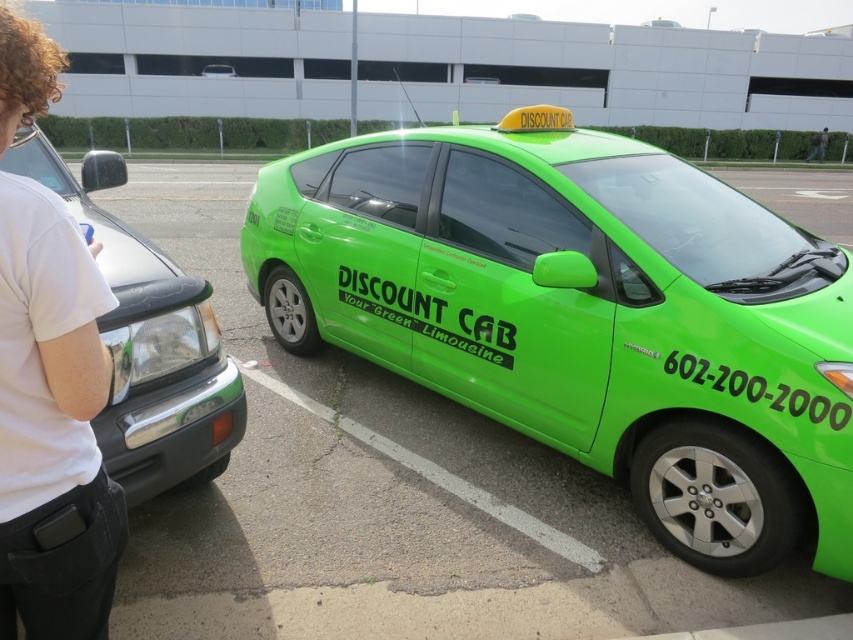
Question: Is green matte taxi at center smaller than green matte taxi at upper center?

Choices:
 (A) yes
 (B) no

Answer: (B)

Question: Among these objects, which one is farthest from the camera?

Choices:
 (A) green matte taxi at upper center
 (B) matte black car at left
 (C) green matte taxi at center

Answer: (A)

Question: Which point is farther from the camera taking this photo?

Choices:
 (A) (634, 296)
 (B) (230, 68)
 (C) (152, 417)
 (D) (33, 349)

Answer: (B)

Question: Is green matte taxi at center positioned behind green matte taxi at upper center?

Choices:
 (A) no
 (B) yes

Answer: (A)

Question: Among these objects, which one is nearest to the camera?

Choices:
 (A) green matte taxi at center
 (B) white fabric shirt at left
 (C) matte black car at left
 (D) green matte taxi at upper center

Answer: (B)

Question: Is white fabric shirt at left above green matte taxi at upper center?

Choices:
 (A) no
 (B) yes

Answer: (A)